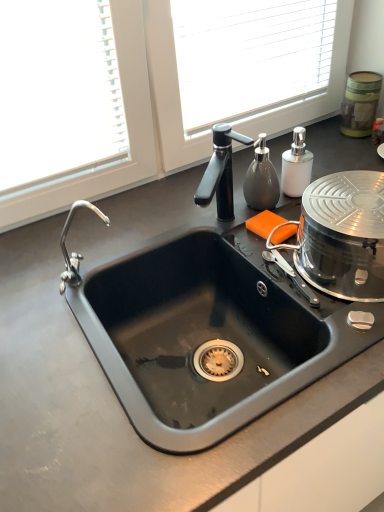
Question: Considering their positions, is green textured canister at upper right, which is the first appliance in top-to-bottom order, located in front of or behind shiny metallic steamer at right, the 2th appliance viewed from the top?

Choices:
 (A) front
 (B) behind

Answer: (B)

Question: Looking at their shapes, would you say green textured canister at upper right, the first appliance in the back-to-front sequence, is wider or thinner than shiny metallic steamer at right, the first appliance in the bottom-to-top sequence?

Choices:
 (A) wide
 (B) thin

Answer: (B)

Question: Considering the real-world distances, which object is closest to the black matte sink at center?

Choices:
 (A) green textured canister at upper right, which is the first appliance in top-to-bottom order
 (B) white matte soap dispenser at upper right
 (C) shiny metallic steamer at right, the first appliance in the bottom-to-top sequence

Answer: (C)

Question: Which of these objects is positioned closest to the black matte sink at center?

Choices:
 (A) green textured canister at upper right, which is the first appliance in top-to-bottom order
 (B) shiny metallic steamer at right, the first appliance in the bottom-to-top sequence
 (C) white matte soap dispenser at upper right

Answer: (B)